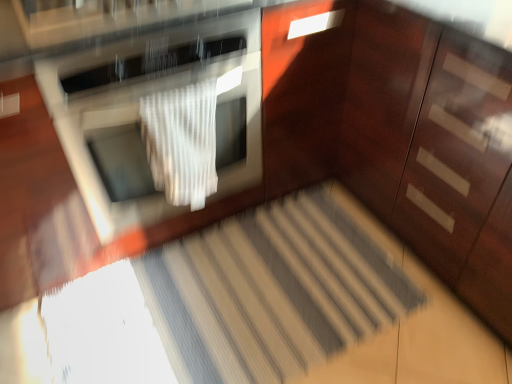
Locate an element on the screen. vacant location below striped carpet at center (from a real-world perspective) is located at coordinates 223,315.